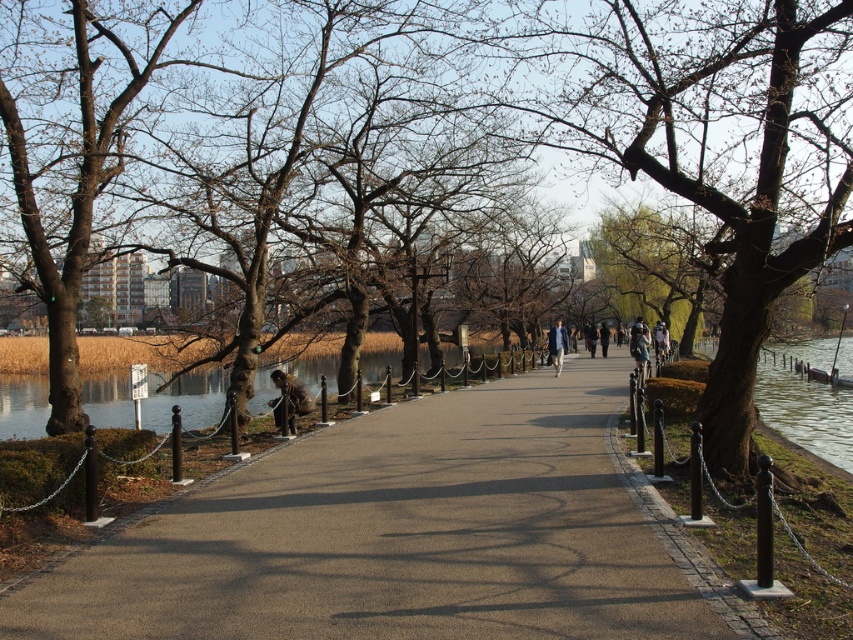
Question: Is brown bark tree at center smaller than brown leather jacket at center?

Choices:
 (A) no
 (B) yes

Answer: (A)

Question: Which object is closer to the camera taking this photo?

Choices:
 (A) smooth asphalt path at center
 (B) brown bark tree at center

Answer: (A)

Question: Can you confirm if denim jacket at center is smaller than blue fabric jacket at center?

Choices:
 (A) yes
 (B) no

Answer: (B)

Question: Observing the image, what is the correct spatial positioning of denim jacket at center in reference to blue fabric jacket at center?

Choices:
 (A) above
 (B) below

Answer: (B)

Question: Which object is closer to the camera taking this photo?

Choices:
 (A) blue fabric jacket at center
 (B) green leafy tree at center
 (C) brown bark tree at center
 (D) smooth asphalt path at center

Answer: (D)

Question: Among these points, which one is farthest from the camera?

Choices:
 (A) (657, 324)
 (B) (643, 332)

Answer: (A)